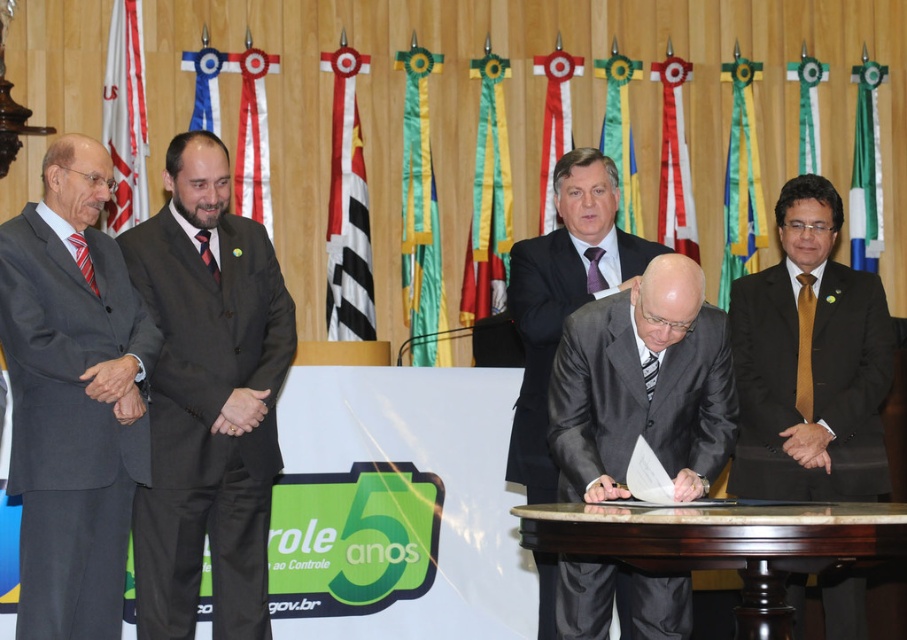
You are a photographer positioned at the back of the room. You need to capture a photo that includes both the green fabric ribbon at center and the white fabric flag at upper center. However, the green ribbon is blocking part of the flag. Can you adjust your position to ensure both are fully visible without any overlap?

The green fabric ribbon at center is much taller than the white fabric flag at upper center. Since the green ribbon is taller, moving your camera angle slightly upward might allow you to capture both without overlap by positioning the camera so the top of the flag is visible above the ribbon.

You are an event planner arranging ribbons for a ceremony. You have a white fabric ribbon at upper center and a green fabric ribbon at upper center. Which ribbon should you place on the left side if the white one is wider?

The white fabric ribbon at upper center is wider than the green fabric ribbon at upper center, so you should place the white fabric ribbon at upper center on the left side to ensure proper alignment based on their widths.